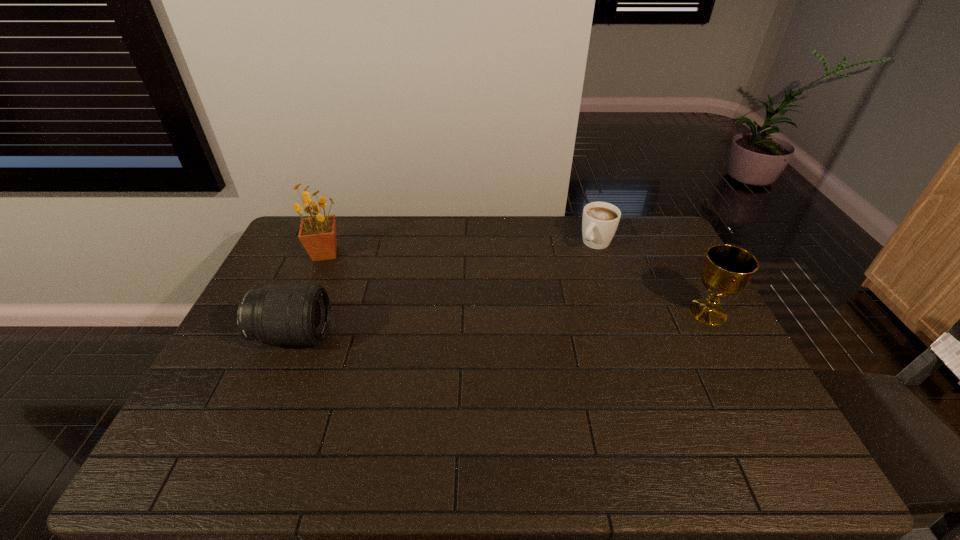
The width and height of the screenshot is (960, 540). I want to click on the second shortest object, so click(300, 314).

Where is `the rightmost object`? The width and height of the screenshot is (960, 540). the rightmost object is located at coordinates (727, 269).

Locate an element on the screen. Image resolution: width=960 pixels, height=540 pixels. chalice is located at coordinates tap(727, 269).

The width and height of the screenshot is (960, 540). I want to click on the second object from right to left, so click(600, 220).

The image size is (960, 540). I want to click on cappuccino, so click(600, 220).

I want to click on the tallest object, so click(317, 233).

Find the location of a particular element. free point located 0.050m on the surface of the telephoto lens is located at coordinates (347, 335).

The image size is (960, 540). I want to click on vacant space located 0.290m on the back of the chalice, so click(669, 242).

At what (x,y) coordinates should I click in order to perform the action: click on vacant region located 0.330m with the handle on the side of the cappuccino. Please return your answer as a coordinate pair (x, y). Looking at the image, I should click on (538, 306).

Locate an element on the screen. free location located with the handle on the side of the cappuccino is located at coordinates (573, 269).